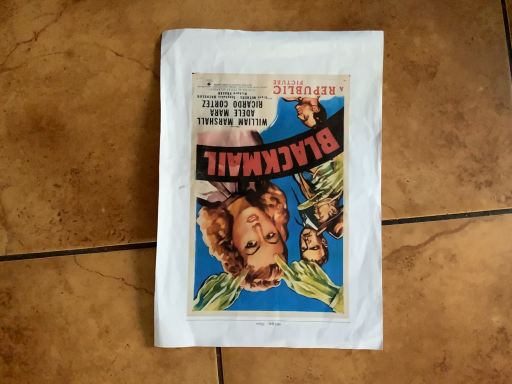
The width and height of the screenshot is (512, 384). I want to click on free spot above vibrant paper poster at center (from a real-world perspective), so click(x=272, y=177).